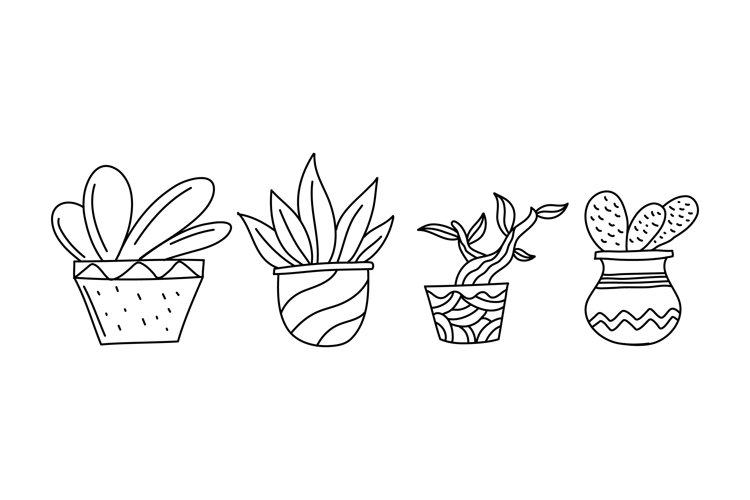
Where is `second vase`? The height and width of the screenshot is (500, 750). second vase is located at coordinates [x=328, y=286].